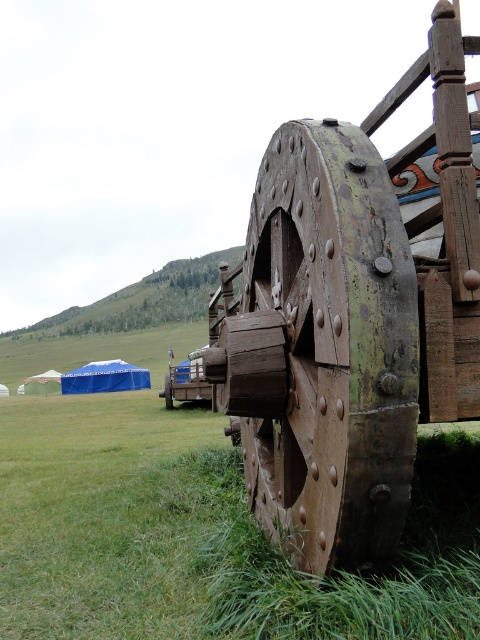
You are setting up a tent for a camping trip and have a white fabric tent at lower left. You also see a rusty wood wheel at center. Which object is wider?

The white fabric tent at lower left is wider than the rusty wood wheel at center.

You are standing in front of the wooden wheel and want to place a small pebble at one of the two points mentioned. Which point is closer to you, point (336, 513) or point (43, 388)?

Point (336, 513) is closer to the camera than point (43, 388), so you should place the pebble at point (336, 513) since it is closer to you.

You are standing in the field where the large wooden wheel is placed. There is a white fabric tent at lower left. Where is the point at coordinate (41, 381) located?

The point at coordinate (41, 381) is located on the white fabric tent at lower left.